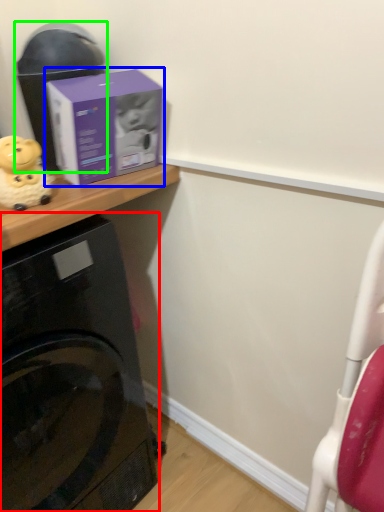
Question: Which object is positioned closest to home appliance (highlighted by a red box)? Select from box (highlighted by a blue box) and appliance (highlighted by a green box).

Choices:
 (A) box
 (B) appliance

Answer: (A)